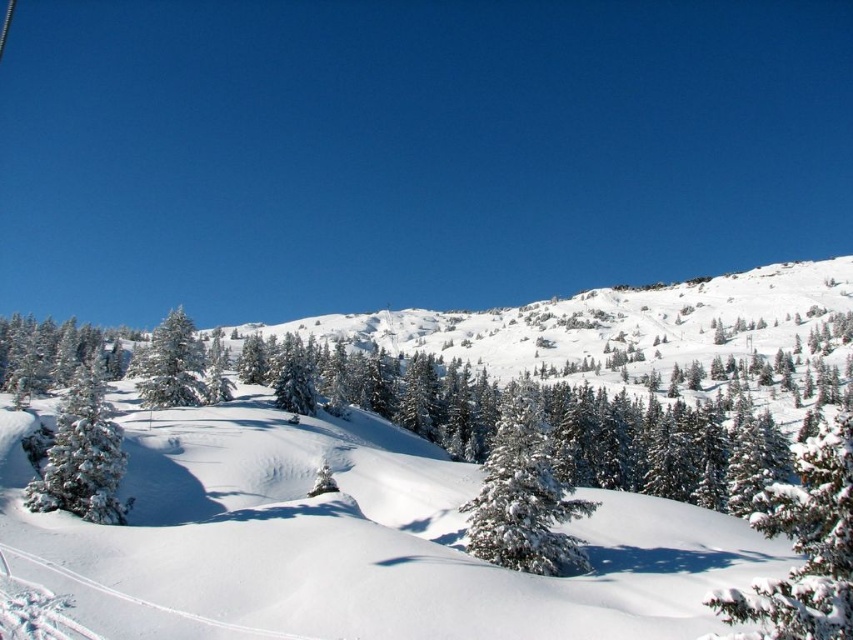
Question: Which object is positioned closest to the green textured pine at lower right?

Choices:
 (A) white frosty tree at left
 (B) white fluffy snow at center
 (C) green matte tree at left

Answer: (A)

Question: Does green textured pine at lower right have a smaller size compared to green matte tree at left?

Choices:
 (A) no
 (B) yes

Answer: (A)

Question: Can you confirm if green textured pine at lower right is positioned to the right of white snow-covered tree at center?

Choices:
 (A) no
 (B) yes

Answer: (B)

Question: Among these points, which one is nearest to the camera?

Choices:
 (A) (186, 602)
 (B) (509, 515)

Answer: (A)

Question: Among these objects, which one is nearest to the camera?

Choices:
 (A) white snow-covered tree at center
 (B) green matte tree at left

Answer: (A)

Question: Can you confirm if white snow-covered tree at center is wider than white frosty tree at left?

Choices:
 (A) yes
 (B) no

Answer: (B)